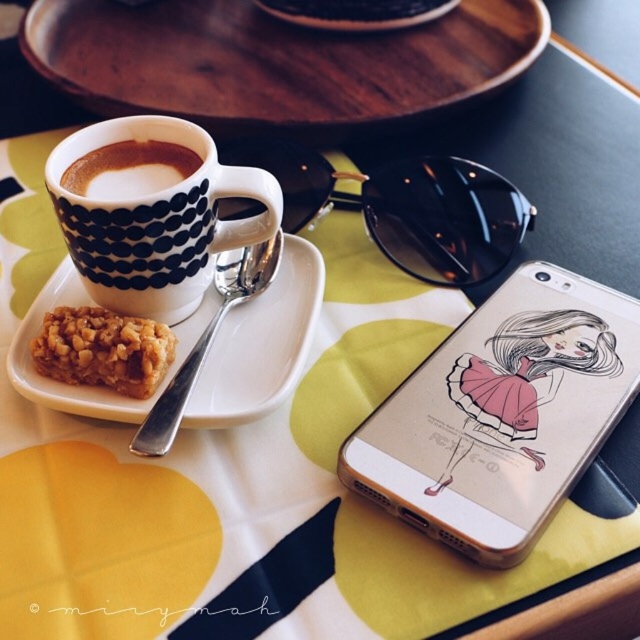
Question: Which point appears closest to the camera in this image?

Choices:
 (A) (88, 278)
 (B) (243, 64)
 (C) (461, 275)
 (D) (289, 19)

Answer: (A)

Question: Considering the relative positions of crispy golden bar at upper left and brown matte cup at upper left in the image provided, where is crispy golden bar at upper left located with respect to brown matte cup at upper left?

Choices:
 (A) below
 (B) above

Answer: (A)

Question: Which object is the closest to the transparent plastic phone case at upper right?

Choices:
 (A) matte black cup at upper left
 (B) white matte saucer at upper left

Answer: (B)

Question: Is transparent plastic phone case at upper right above matte black cup at upper left?

Choices:
 (A) yes
 (B) no

Answer: (B)

Question: Which object is closer to the camera taking this photo?

Choices:
 (A) matte black cup at upper left
 (B) transparent plastic phone case at upper right
 (C) black plastic goggles at upper center

Answer: (B)

Question: Is transparent plastic phone case at upper right bigger than wooden tray at upper center?

Choices:
 (A) yes
 (B) no

Answer: (B)